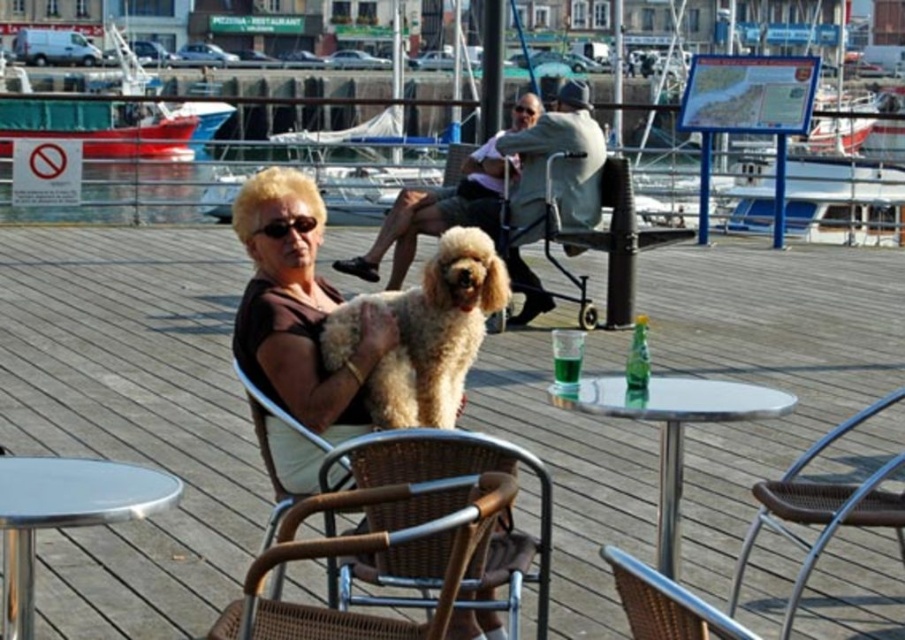
Is polished stainless steel table at lower left bigger than woven wicker chair at center?

Yes, polished stainless steel table at lower left is bigger than woven wicker chair at center.

Does polished stainless steel table at lower left come in front of woven wicker chair at center?

No, it is behind woven wicker chair at center.

Locate an element on the screen. The width and height of the screenshot is (905, 640). polished stainless steel table at lower left is located at coordinates (64, 513).

Identify the location of polished stainless steel table at lower left. [x=64, y=513].

Can you confirm if shiny metallic table at center is wider than brown woven chair at lower right?

Correct, the width of shiny metallic table at center exceeds that of brown woven chair at lower right.

Can you confirm if shiny metallic table at center is shorter than brown woven chair at lower right?

Yes.

Who is more distant from viewer, (677, 492) or (864, 500)?

The point (677, 492) is more distant.

The image size is (905, 640). I want to click on shiny metallic table at center, so click(672, 428).

Can you confirm if beige wicker chair at center is wider than brown wicker chair at center?

Yes.

Does beige wicker chair at center have a greater height compared to brown wicker chair at center?

Yes.

Does point (121, 442) lie behind point (318, 637)?

Yes.

Where is `beige wicker chair at center`? Image resolution: width=905 pixels, height=640 pixels. beige wicker chair at center is located at coordinates (132, 417).